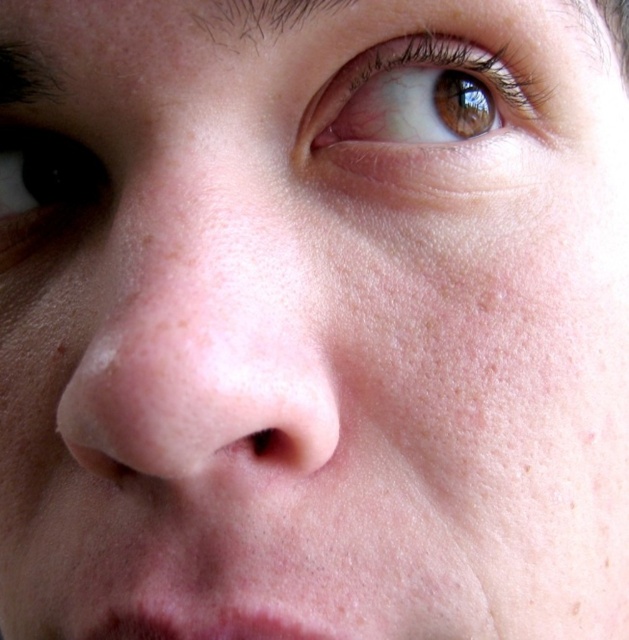
Question: Is brown glossy eye at upper center smaller than pink matte lips at lower center?

Choices:
 (A) yes
 (B) no

Answer: (B)

Question: Which point is farther to the camera?

Choices:
 (A) (14, 45)
 (B) (306, 344)
 (C) (13, 234)

Answer: (C)

Question: Observing the image, what is the correct spatial positioning of pink smooth nose at center in reference to dark brown eye at upper left?

Choices:
 (A) above
 (B) below

Answer: (B)

Question: Which is nearer to the dark brown hair at upper center?

Choices:
 (A) dark brown eye at upper left
 (B) pink smooth nose at center
 (C) pink matte lips at lower center
 (D) brown glossy eye at upper center

Answer: (D)

Question: Which object is the closest to the dark brown hair at upper left?

Choices:
 (A) pink smooth nose at center
 (B) dark brown hair at upper center

Answer: (B)

Question: Is dark brown eye at upper left below pink matte lips at lower center?

Choices:
 (A) no
 (B) yes

Answer: (A)